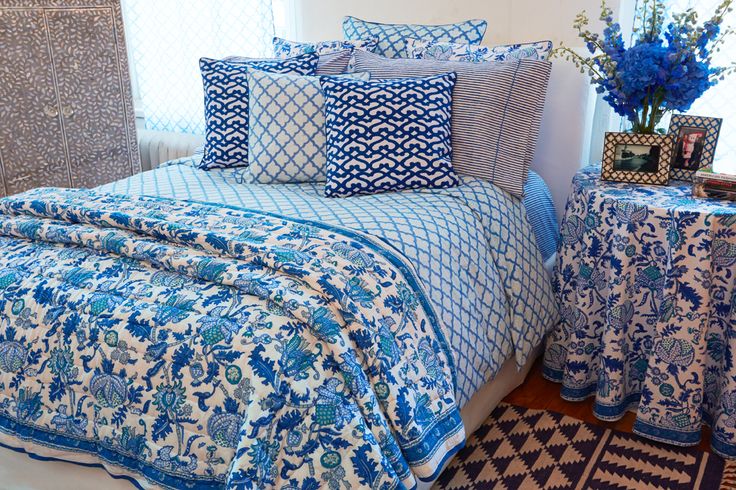
Where is `pillows`? pillows is located at coordinates [x=392, y=114], [x=311, y=96], [x=277, y=59], [x=330, y=41], [x=394, y=41], [x=438, y=53], [x=421, y=74].